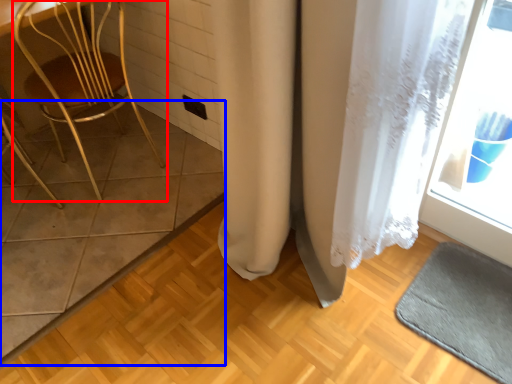
Question: Which object is further to the camera taking this photo, chair (highlighted by a red box) or tile (highlighted by a blue box)?

Choices:
 (A) chair
 (B) tile

Answer: (B)